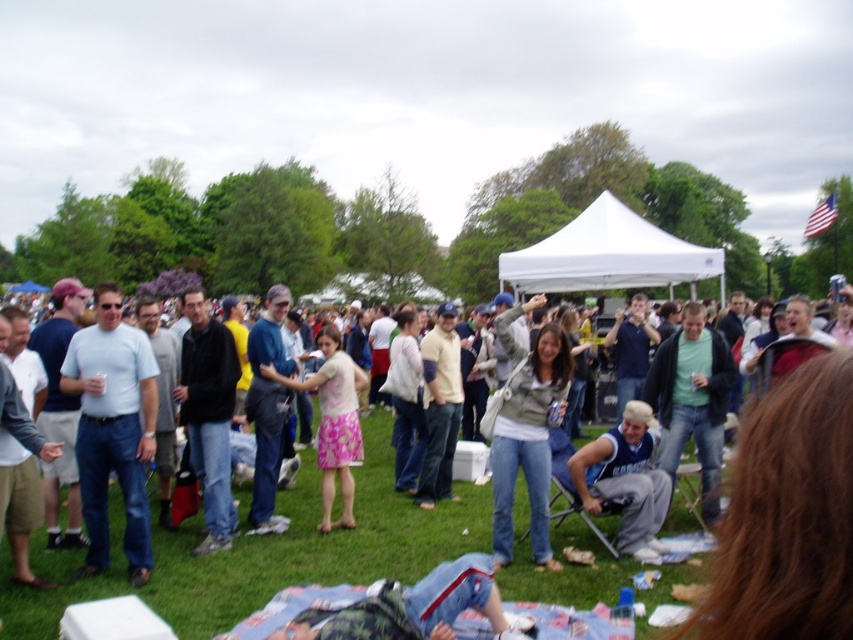
Can you confirm if denim jacket at center is positioned above light brown denim jeans at center?

Actually, denim jacket at center is below light brown denim jeans at center.

Describe the element at coordinates (527, 432) in the screenshot. I see `denim jacket at center` at that location.

I want to click on denim jacket at center, so click(527, 432).

Which is behind, point (590, 212) or point (643, 384)?

Positioned behind is point (590, 212).

Between white fabric canopy at center and green matte shirt at center, which one has more height?

white fabric canopy at center

Which is behind, point (576, 216) or point (717, 394)?

Point (576, 216)

Where is `white fabric canopy at center`? Image resolution: width=853 pixels, height=640 pixels. white fabric canopy at center is located at coordinates (608, 256).

How distant is green grass at center from matte light blue shirt at center?

green grass at center and matte light blue shirt at center are 2.21 meters apart.

Locate an element on the screen. The width and height of the screenshot is (853, 640). green grass at center is located at coordinates (265, 554).

Locate an element on the screen. The height and width of the screenshot is (640, 853). green grass at center is located at coordinates (265, 554).